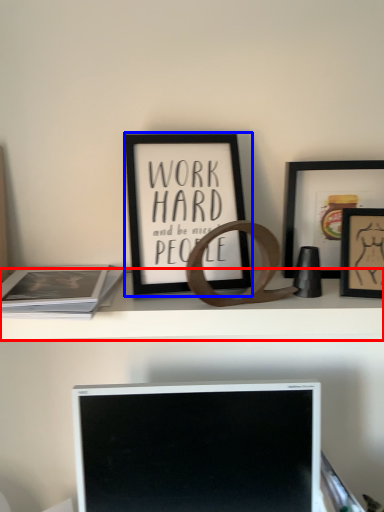
Question: Among these objects, which one is farthest to the camera, shelf (highlighted by a red box) or picture frame (highlighted by a blue box)?

Choices:
 (A) shelf
 (B) picture frame

Answer: (A)